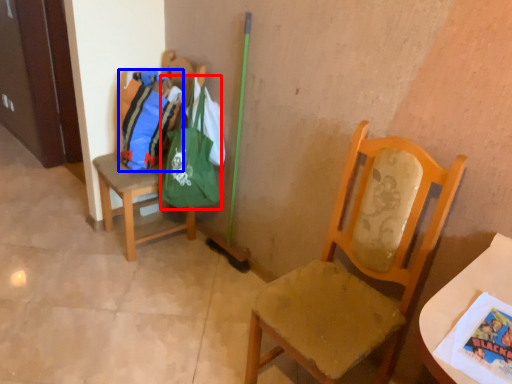
Question: Among these objects, which one is nearest to the camera, bag (highlighted by a red box) or bag (highlighted by a blue box)?

Choices:
 (A) bag
 (B) bag

Answer: (A)